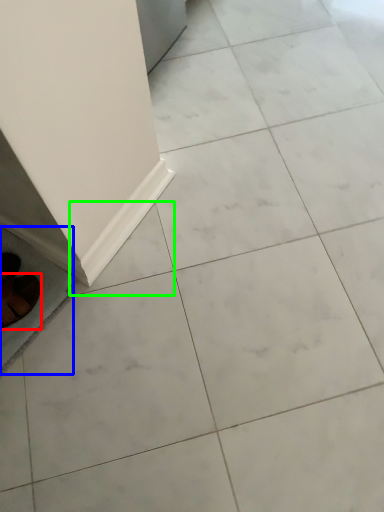
Question: Considering the real-world distances, which object is closest to footwear (highlighted by a red box)? ceramic tile (highlighted by a blue box) or ceramic tile (highlighted by a green box).

Choices:
 (A) ceramic tile
 (B) ceramic tile

Answer: (A)